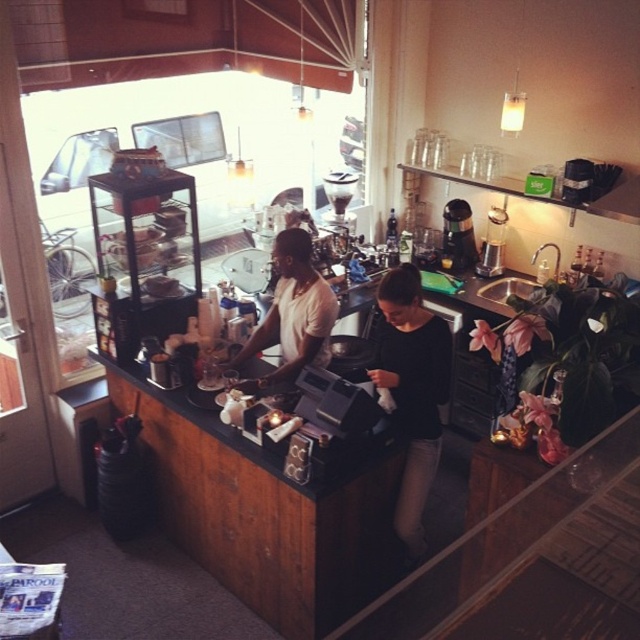
You are standing at the entrance of the cafe and want to reach the cash register located at point (x=404, y=390). If your maximum reach distance is 2 meters, can you grab the cash register without moving closer?

The distance of point (x=404, y=390) from camera is 3.23 meters, so you cannot grab the cash register without moving closer since it is beyond your 2 meters reach distance.

You are a customer in the cafe and want to reach both the point at coordinates (396,509) and the point at coordinates (321,301). Which point should you approach first to minimize your walking distance?

You should approach point (396,509) first since it is closer to you than point (321,301), so reaching it first would minimize the total walking distance.